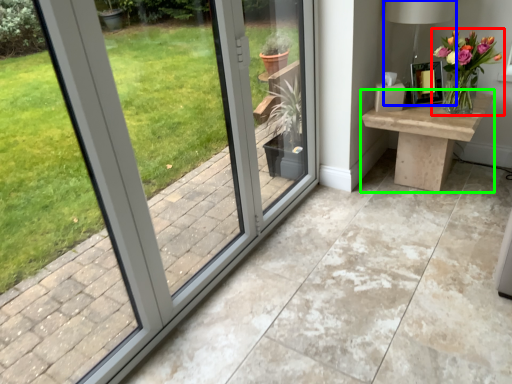
Question: Based on their relative distances, which object is farther from houseplant (highlighted by a red box)? Choose from table lamp (highlighted by a blue box) and table (highlighted by a green box).

Choices:
 (A) table lamp
 (B) table

Answer: (A)